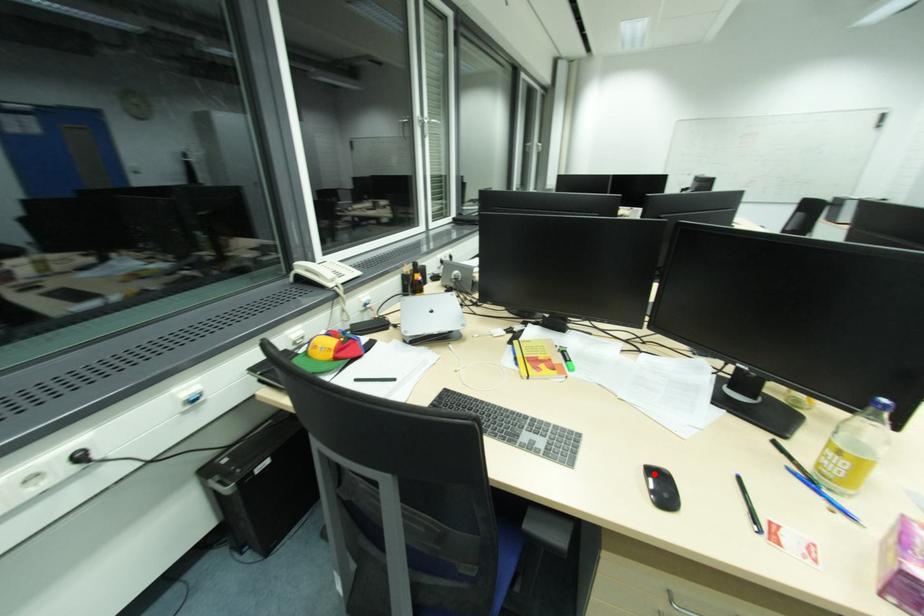
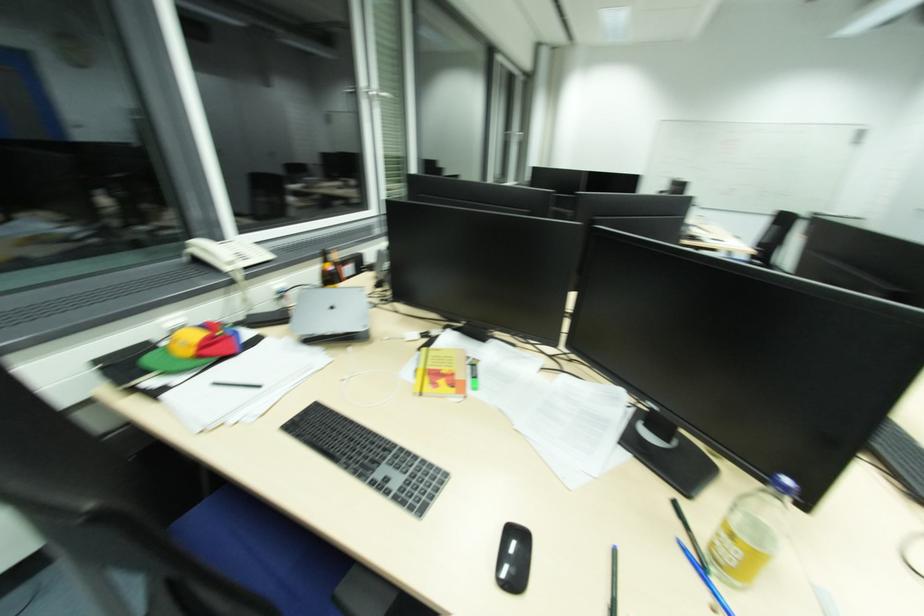
Locate, in the second image, the point that corresponds to the highlighted location in the first image.

(514, 533)